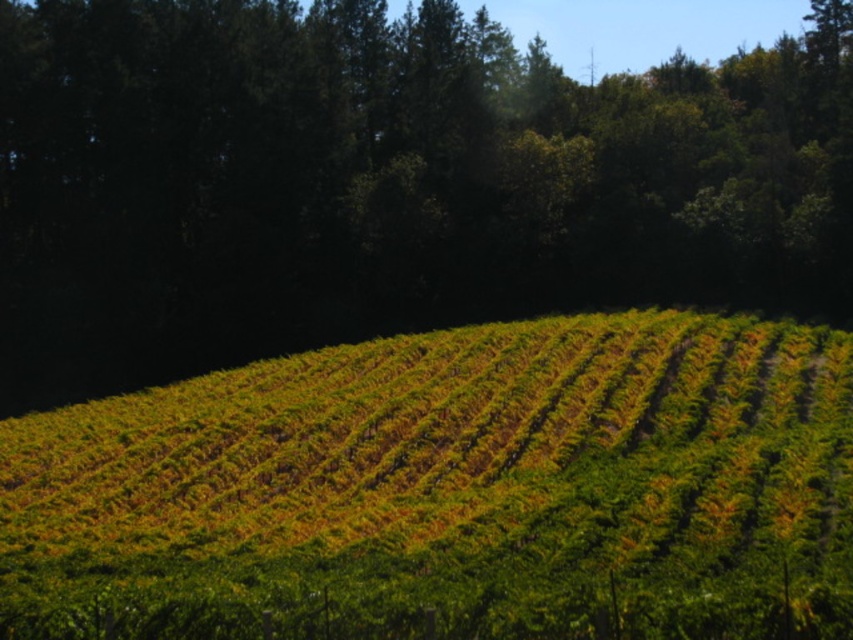
You are standing in the vineyard and looking towards the center of the image. Which object is higher in your field of view between the green leafy tree at center and the green leafy hillside at center?

The green leafy tree at center is higher in your field of view than the green leafy hillside at center.

Based on the scene description, which object, the green leafy tree at center or the green leafy hillside at center, occupies a larger horizontal space in the image?

The green leafy tree at center might be wider than the green leafy hillside at center according to the description provided.